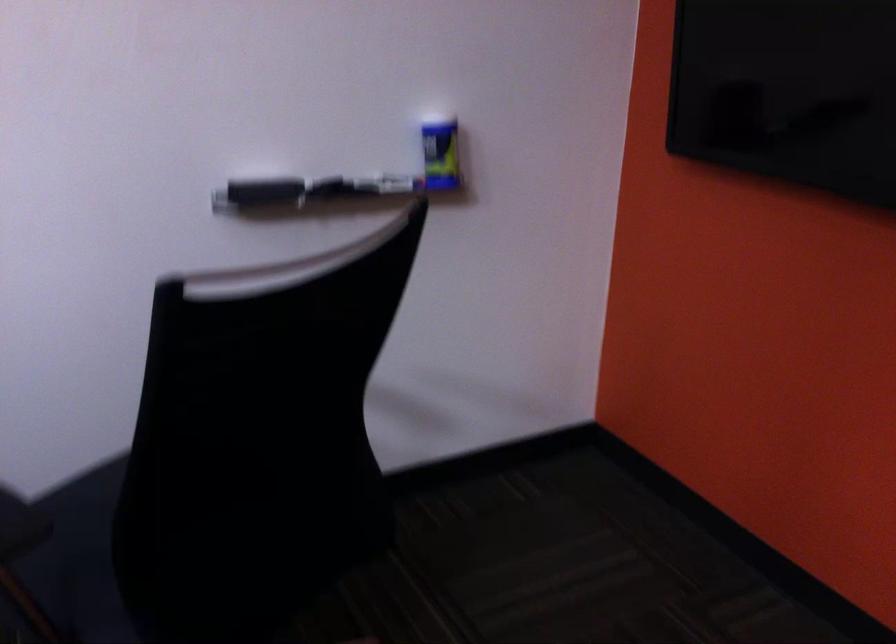
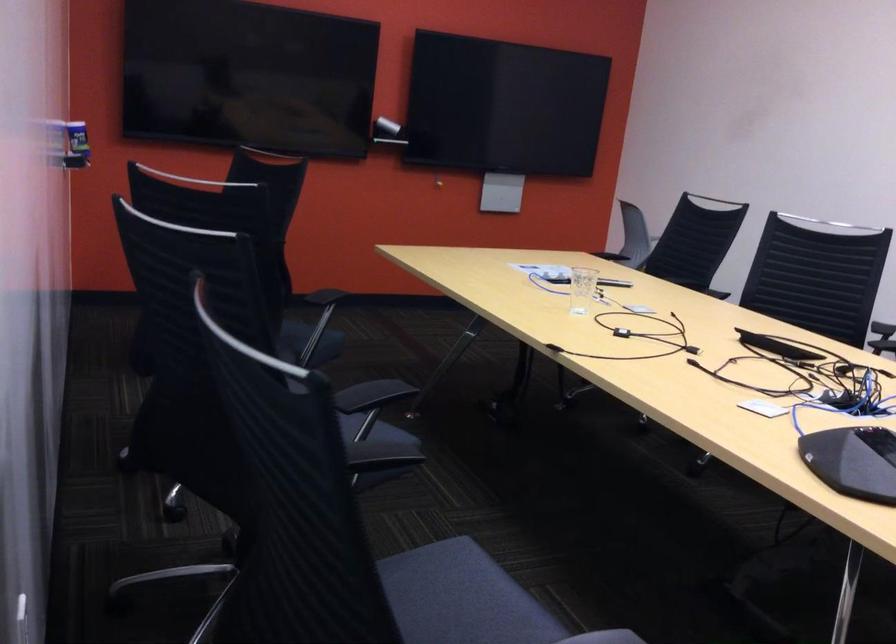
Find the pixel in the second image that matches point (408, 187) in the first image.

(76, 145)